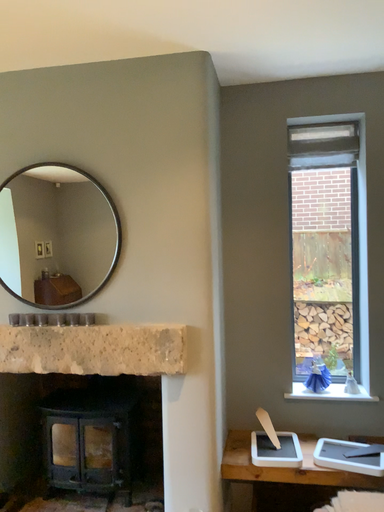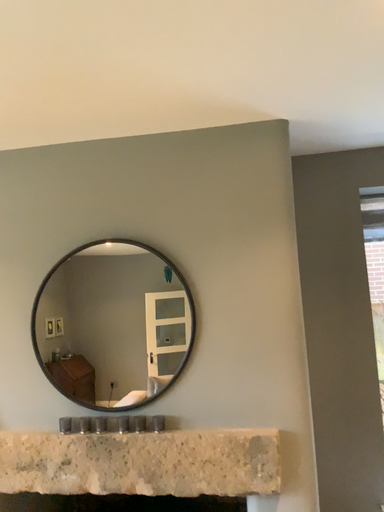
Question: Which way did the camera rotate in the video?

Choices:
 (A) rotated downward
 (B) rotated upward

Answer: (B)